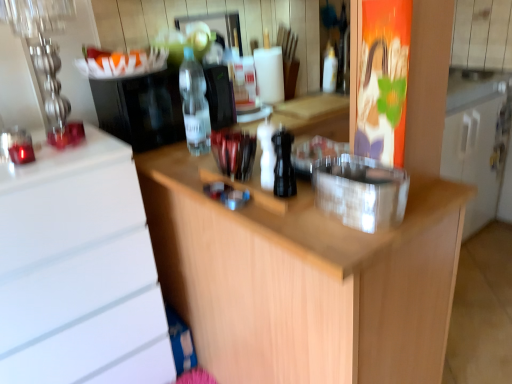
Question: Which direction should I rotate to look at transparent plastic bottle at center, which is the second bottle from front to back, — up or down?

Choices:
 (A) up
 (B) down

Answer: (A)

Question: From a real-world perspective, does wooden at center stand above transparent plastic bottle at upper center, arranged as the third bottle when viewed from the front?

Choices:
 (A) yes
 (B) no

Answer: (B)

Question: Is wooden at center next to transparent plastic bottle at upper center, which is the 1th bottle in top-to-bottom order?

Choices:
 (A) no
 (B) yes

Answer: (A)

Question: From a real-world perspective, is wooden at center located beneath transparent plastic bottle at upper center, which appears as the 1th bottle when viewed from the back?

Choices:
 (A) yes
 (B) no

Answer: (A)

Question: Does wooden at center turn towards transparent plastic bottle at upper center, arranged as the third bottle when viewed from the front?

Choices:
 (A) no
 (B) yes

Answer: (A)

Question: Is wooden at center positioned before transparent plastic bottle at upper center, arranged as the third bottle when viewed from the front?

Choices:
 (A) yes
 (B) no

Answer: (A)

Question: Can you confirm if wooden at center is shorter than transparent plastic bottle at upper center, which is the 1th bottle in top-to-bottom order?

Choices:
 (A) yes
 (B) no

Answer: (B)

Question: Can you confirm if wooden at center is positioned to the right of transparent plastic container at center, which is counted as the first appliance, starting from the bottom?

Choices:
 (A) yes
 (B) no

Answer: (A)

Question: Does wooden at center come in front of transparent plastic container at center, which is the second appliance in back-to-front order?

Choices:
 (A) no
 (B) yes

Answer: (B)

Question: Is wooden at center aimed at transparent plastic container at center, which appears as the first appliance when viewed from the right?

Choices:
 (A) yes
 (B) no

Answer: (B)

Question: From the image's perspective, is wooden at center under transparent plastic container at center, acting as the 2th appliance starting from the top?

Choices:
 (A) yes
 (B) no

Answer: (A)

Question: From a real-world perspective, is wooden at center located beneath transparent plastic container at center, acting as the 2th appliance starting from the top?

Choices:
 (A) no
 (B) yes

Answer: (B)

Question: Is wooden at center placed right next to transparent plastic container at center, which is the second appliance in back-to-front order?

Choices:
 (A) no
 (B) yes

Answer: (A)

Question: Is transparent plastic container at center, the second appliance from the left, directly adjacent to transparent plastic bottle at upper center, marked as the 3th bottle in a left-to-right arrangement?

Choices:
 (A) yes
 (B) no

Answer: (B)